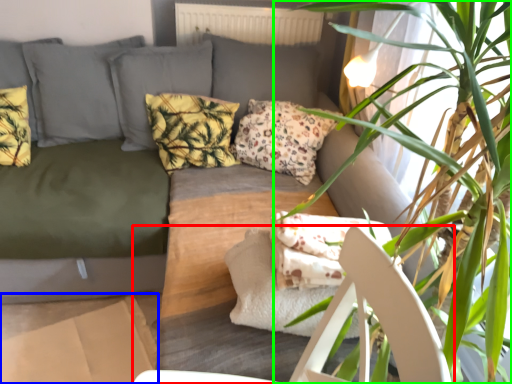
Question: Based on their relative distances, which object is nearer to armchair (highlighted by a red box)? Choose from cardboard box (highlighted by a blue box) and houseplant (highlighted by a green box).

Choices:
 (A) cardboard box
 (B) houseplant

Answer: (B)